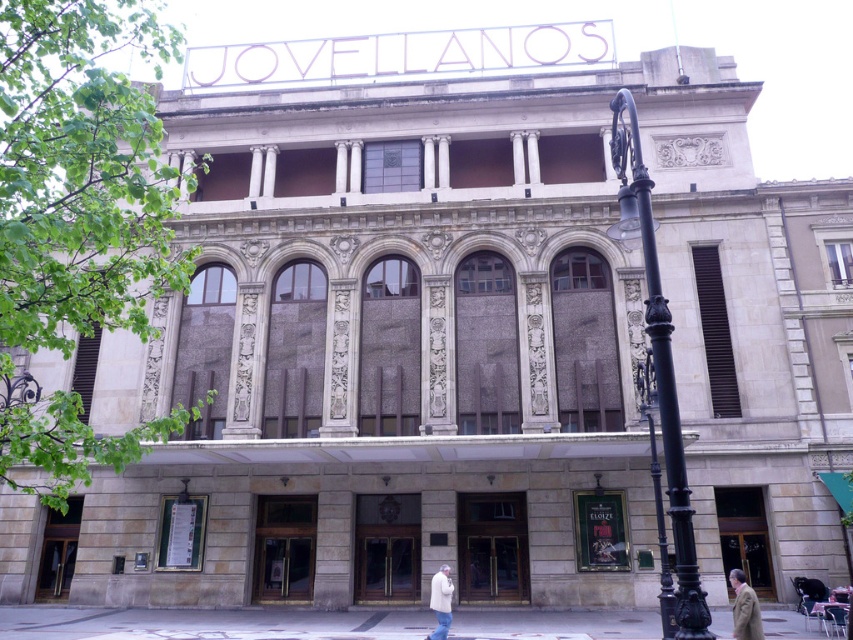
Is black wrought iron streetlight at right above white wool coat at lower center?

Indeed, black wrought iron streetlight at right is positioned over white wool coat at lower center.

Can you confirm if black wrought iron streetlight at right is wider than white wool coat at lower center?

Yes, black wrought iron streetlight at right is wider than white wool coat at lower center.

Is point (633, 164) positioned behind point (442, 620)?

No, it is not.

The width and height of the screenshot is (853, 640). What are the coordinates of `black wrought iron streetlight at right` in the screenshot? It's located at (659, 371).

Looking at this image, can you confirm if smooth concrete pavement at lower center is positioned to the left of brown wool coat at lower right?

Indeed, smooth concrete pavement at lower center is positioned on the left side of brown wool coat at lower right.

Does smooth concrete pavement at lower center have a lesser height compared to brown wool coat at lower right?

Correct, smooth concrete pavement at lower center is not as tall as brown wool coat at lower right.

Is point (254, 634) closer to viewer compared to point (740, 577)?

No, (254, 634) is further to viewer.

Image resolution: width=853 pixels, height=640 pixels. I want to click on smooth concrete pavement at lower center, so click(x=210, y=624).

Does smooth concrete pavement at lower center have a smaller size compared to white wool coat at lower center?

Incorrect, smooth concrete pavement at lower center is not smaller in size than white wool coat at lower center.

Can you confirm if smooth concrete pavement at lower center is thinner than white wool coat at lower center?

In fact, smooth concrete pavement at lower center might be wider than white wool coat at lower center.

Image resolution: width=853 pixels, height=640 pixels. Describe the element at coordinates (210, 624) in the screenshot. I see `smooth concrete pavement at lower center` at that location.

Find the location of a particular element. smooth concrete pavement at lower center is located at coordinates (210, 624).